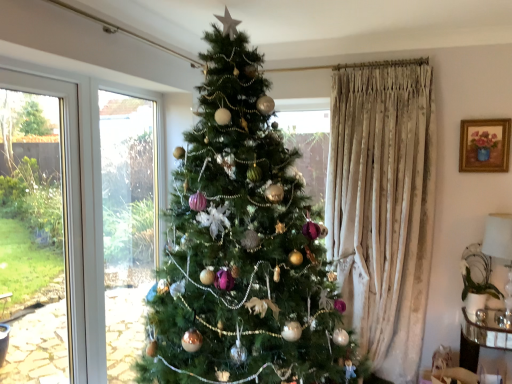
In order to click on white glossy lampshade at right in this screenshot , I will do `click(500, 251)`.

In order to click on lamp above the clear glass side table at lower right (from the image's perspective) in this screenshot , I will do `click(500, 251)`.

Between white glossy lampshade at right and clear glass side table at lower right, which one has larger width?

clear glass side table at lower right.

Considering the relative sizes of white glossy lampshade at right and clear glass side table at lower right in the image provided, is white glossy lampshade at right bigger than clear glass side table at lower right?

No, white glossy lampshade at right is not bigger than clear glass side table at lower right.

Is clear glass side table at lower right with green matte christmas tree at center?

clear glass side table at lower right is not next to green matte christmas tree at center, and they're not touching.

Locate an element on the screen. The height and width of the screenshot is (384, 512). christmas tree on the left of the clear glass side table at lower right is located at coordinates (243, 248).

Based on the photo, from the image's perspective, would you say clear glass side table at lower right is positioned over green matte christmas tree at center?

No.

Does point (490, 319) come closer to viewer compared to point (226, 304)?

No, (490, 319) is further to viewer.

Considering the relative sizes of green matte christmas tree at center and clear glass side table at lower right in the image provided, is green matte christmas tree at center shorter than clear glass side table at lower right?

Incorrect, the height of green matte christmas tree at center does not fall short of that of clear glass side table at lower right.

From a real-world perspective, is green matte christmas tree at center above or below clear glass side table at lower right?

green matte christmas tree at center is situated higher than clear glass side table at lower right in the real world.

Is green matte christmas tree at center not near clear glass side table at lower right?

Absolutely, green matte christmas tree at center is distant from clear glass side table at lower right.

Is point (195, 257) closer or farther from the camera than point (501, 329)?

Point (195, 257).

Is clear glass side table at lower right wider or thinner than white glossy lampshade at right?

Clearly, clear glass side table at lower right has more width compared to white glossy lampshade at right.

What's the angular difference between clear glass side table at lower right and white glossy lampshade at right's facing directions?

The facing directions of clear glass side table at lower right and white glossy lampshade at right are 9.76e-05 degrees apart.

Between clear glass side table at lower right and white glossy lampshade at right, which one has smaller size?

Smaller between the two is white glossy lampshade at right.

Which object is positioned more to the right, clear glass side table at lower right or white glossy lampshade at right?

white glossy lampshade at right.

Are gold-framed painting at upper right and clear glass side table at lower right located far from each other?

Indeed, gold-framed painting at upper right is not near clear glass side table at lower right.

How different are the orientations of gold-framed painting at upper right and clear glass side table at lower right in degrees?

gold-framed painting at upper right and clear glass side table at lower right are facing 1.43 degrees away from each other.

From a real-world perspective, is gold-framed painting at upper right beneath clear glass side table at lower right?

Actually, gold-framed painting at upper right is physically above clear glass side table at lower right in the real world.

Can you see green matte christmas tree at center touching gold-framed painting at upper right?

No, green matte christmas tree at center is not beside gold-framed painting at upper right.

From the image's perspective, relative to gold-framed painting at upper right, is green matte christmas tree at center above or below?

green matte christmas tree at center is situated lower than gold-framed painting at upper right in the image.

You are a GUI agent. You are given a task and a screenshot of the screen. Output one action in this format:
    pyautogui.click(x=<x>, y=<y>)
    Task: Click on the christmas tree that is in front of the gold-framed painting at upper right
    This screenshot has height=384, width=512.
    Given the screenshot: What is the action you would take?
    pyautogui.click(x=243, y=248)

In the scene shown: What's the angular difference between green matte christmas tree at center and gold-framed painting at upper right's facing directions?

90 degrees.

Is white glossy lampshade at right bigger than gold-framed painting at upper right?

Indeed, white glossy lampshade at right has a larger size compared to gold-framed painting at upper right.

Could you tell me if white glossy lampshade at right is facing gold-framed painting at upper right?

No, white glossy lampshade at right is not facing towards gold-framed painting at upper right.

Would you say white glossy lampshade at right is inside or outside gold-framed painting at upper right?

white glossy lampshade at right is not inside gold-framed painting at upper right, it's outside.

Are white glossy lampshade at right and gold-framed painting at upper right beside each other?

No, white glossy lampshade at right is not touching gold-framed painting at upper right.

This screenshot has width=512, height=384. Identify the location of lamp that is on the right side of clear glass side table at lower right. (500, 251).

Image resolution: width=512 pixels, height=384 pixels. Identify the location of christmas tree located on the left of clear glass side table at lower right. (243, 248).

Looking at the image, which one is located further to green matte christmas tree at center, gold-framed painting at upper right or clear glass side table at lower right?

Based on the image, gold-framed painting at upper right appears to be further to green matte christmas tree at center.

Which object lies nearer to the anchor point gold-framed painting at upper right, green matte christmas tree at center or clear glass side table at lower right?

clear glass side table at lower right is closer to gold-framed painting at upper right.

Looking at the image, which one is located further to gold-framed painting at upper right, clear glass side table at lower right or white glossy lampshade at right?

Among the two, clear glass side table at lower right is located further to gold-framed painting at upper right.

From the image, which object appears to be nearer to green matte christmas tree at center, clear glass side table at lower right or white glossy lampshade at right?

white glossy lampshade at right lies closer to green matte christmas tree at center than the other object.

Looking at the image, which one is located further to green matte christmas tree at center, white glossy lampshade at right or gold-framed painting at upper right?

gold-framed painting at upper right lies further to green matte christmas tree at center than the other object.

Estimate the real-world distances between objects in this image. Which object is closer to green matte christmas tree at center, gold-framed painting at upper right or white glossy lampshade at right?

white glossy lampshade at right.

Considering their positions, is clear glass side table at lower right positioned further to gold-framed painting at upper right than green matte christmas tree at center?

Based on the image, green matte christmas tree at center appears to be further to gold-framed painting at upper right.

From the image, which object appears to be nearer to gold-framed painting at upper right, green matte christmas tree at center or white glossy lampshade at right?

Based on the image, white glossy lampshade at right appears to be nearer to gold-framed painting at upper right.

The image size is (512, 384). I want to click on lamp between gold-framed painting at upper right and clear glass side table at lower right vertically, so click(500, 251).

Locate an element on the screen. picture frame located between green matte christmas tree at center and white glossy lampshade at right in the left-right direction is located at coordinates 484,145.

Image resolution: width=512 pixels, height=384 pixels. Identify the location of furniture situated between green matte christmas tree at center and gold-framed painting at upper right from left to right. (484, 340).

Where is `furniture between green matte christmas tree at center and white glossy lampshade at right in the horizontal direction`? furniture between green matte christmas tree at center and white glossy lampshade at right in the horizontal direction is located at coordinates (484, 340).